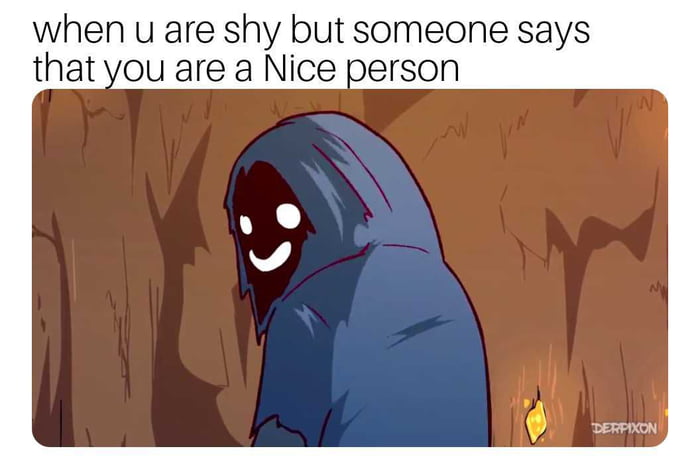
You are a GUI agent. You are given a task and a screenshot of the screen. Output one action in this format:
    pyautogui.click(x=<x>, y=<y>)
    Task: Click on the wrinkles/creases in fabric
    This screenshot has height=465, width=700.
    Given the screenshot: What is the action you would take?
    pyautogui.click(x=351, y=165), pyautogui.click(x=356, y=248), pyautogui.click(x=325, y=310), pyautogui.click(x=325, y=421)